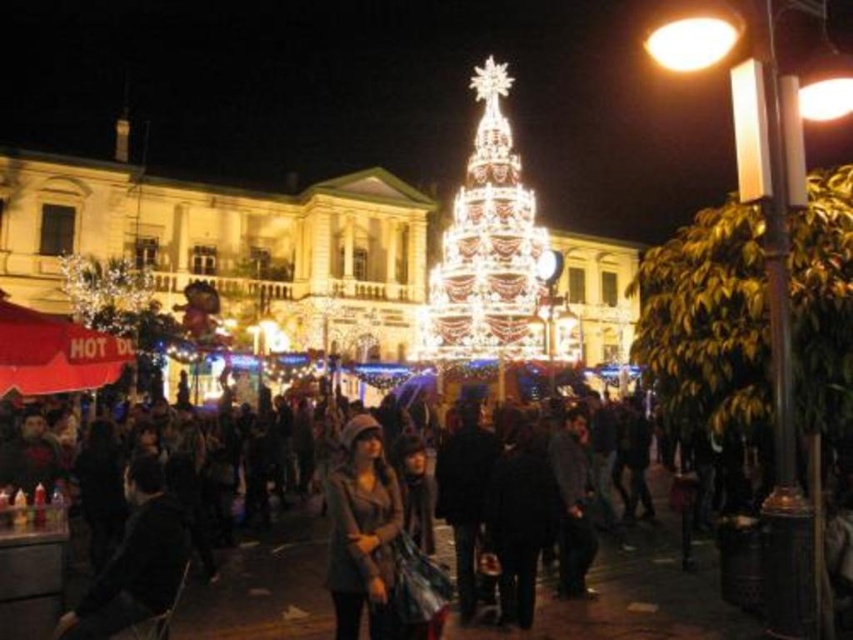
Looking at this image, you are at the festive market and see the dark gray coat at center and the illuminated glass christmas tree at center. Which object is located to the left of the other?

The dark gray coat at center is positioned on the left side of the illuminated glass christmas tree at center.

You are at the festive market and want to find your friend who is wearing a matte gray coat at center. You see the illuminated glass christmas tree at center nearby. Which direction should you look relative to the tree to find the coat?

The matte gray coat at center is positioned on the left side of the illuminated glass christmas tree at center, so you should look to the left of the tree to find the coat.

Looking at this image, you are a photographer trying to capture a wide shot of the illuminated glass christmas tree at center and the dark gray coat at center. Given that your camera can only focus on objects up to 2 meters wide, will both objects fit within the frame?

The dark gray coat at center is wider than the illuminated glass christmas tree at center. Since the camera can only focus on objects up to 2 meters wide, the dark gray coat at center may exceed the width limit, making it difficult to fit both within the frame.